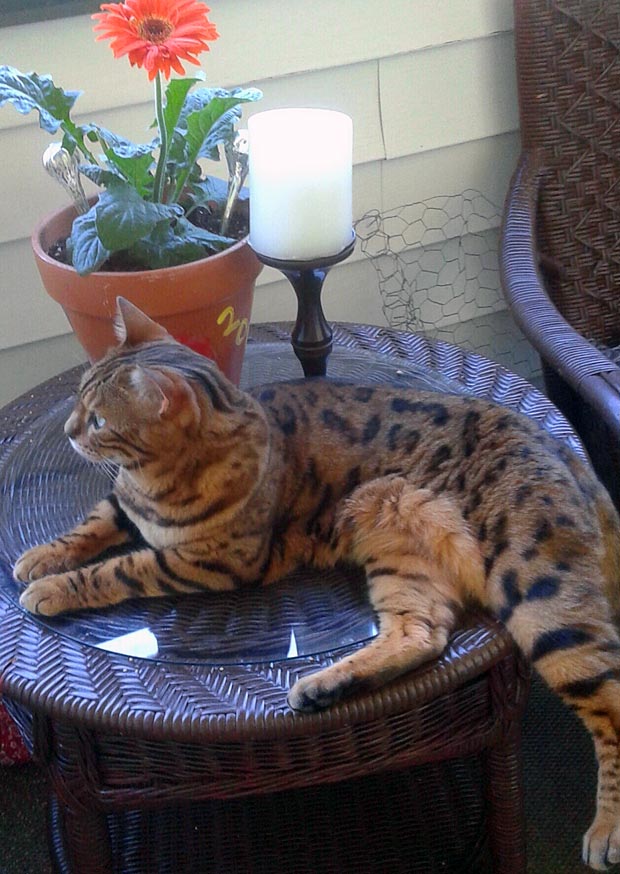
The width and height of the screenshot is (620, 874). Find the location of `chair`. chair is located at coordinates (604, 328).